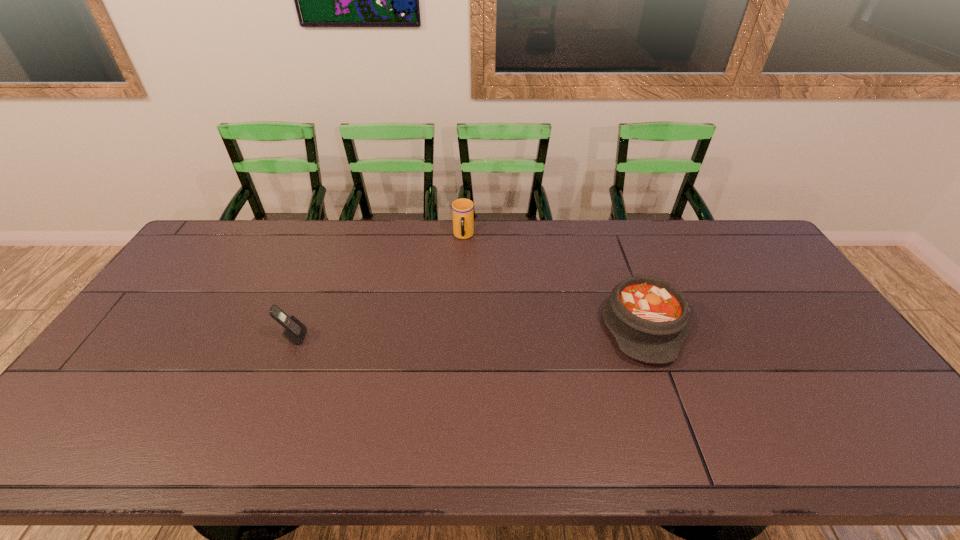
Locate an element on the screen. Image resolution: width=960 pixels, height=540 pixels. the second object from left to right is located at coordinates (462, 209).

You are a GUI agent. You are given a task and a screenshot of the screen. Output one action in this format:
    pyautogui.click(x=<x>, y=<y>)
    Task: Click on the farthest object
    Image resolution: width=960 pixels, height=540 pixels.
    Given the screenshot: What is the action you would take?
    pyautogui.click(x=462, y=209)

What are the coordinates of `the leftmost object` in the screenshot? It's located at (294, 331).

The image size is (960, 540). Find the location of `the rightmost object`. the rightmost object is located at coordinates (648, 317).

Identify the location of free space located 0.350m on the side of the second object from right to left with the handle. The image size is (960, 540). (460, 319).

Image resolution: width=960 pixels, height=540 pixels. I want to click on vacant space located 0.190m on the front-facing side of the cellular telephone, so click(x=372, y=337).

Where is `free space located on the right of the casserole`? This screenshot has height=540, width=960. free space located on the right of the casserole is located at coordinates (794, 325).

You are a GUI agent. You are given a task and a screenshot of the screen. Output one action in this format:
    pyautogui.click(x=<x>, y=<y>)
    Task: Click on the object at the far edge
    This screenshot has width=960, height=540.
    Given the screenshot: What is the action you would take?
    pyautogui.click(x=462, y=209)

I want to click on free space at the far edge of the desktop, so click(x=564, y=248).

Identify the location of free spot at the near edge of the desktop. (563, 441).